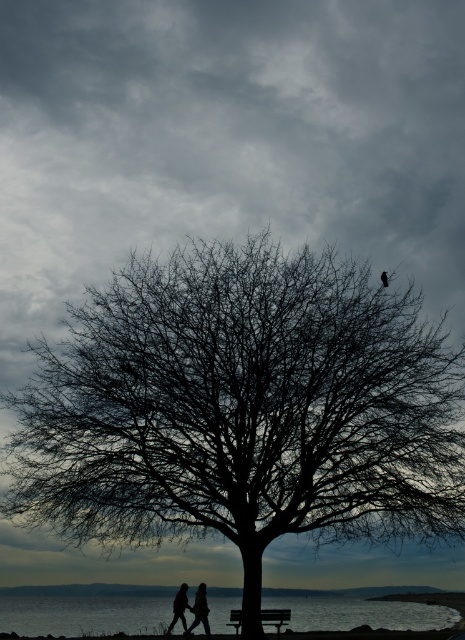
Between silvery water at lower center and silhouette figures at center, which one is positioned lower?

Positioned lower is silvery water at lower center.

Between point (285, 596) and point (183, 602), which one is positioned behind?

The point (285, 596) is behind.

Find the location of a particular element. Image resolution: width=465 pixels, height=640 pixels. silvery water at lower center is located at coordinates (84, 614).

Is smooth sand at lower center thinner than wooden bench at center?

No.

This screenshot has width=465, height=640. I want to click on smooth sand at lower center, so click(372, 634).

Is black bare tree at center to the left of wooden bench at center from the viewer's perspective?

Indeed, black bare tree at center is positioned on the left side of wooden bench at center.

Is point (351, 531) positioned before point (261, 616)?

No.

This screenshot has width=465, height=640. In order to click on black bare tree at center in this screenshot , I will do `click(243, 410)`.